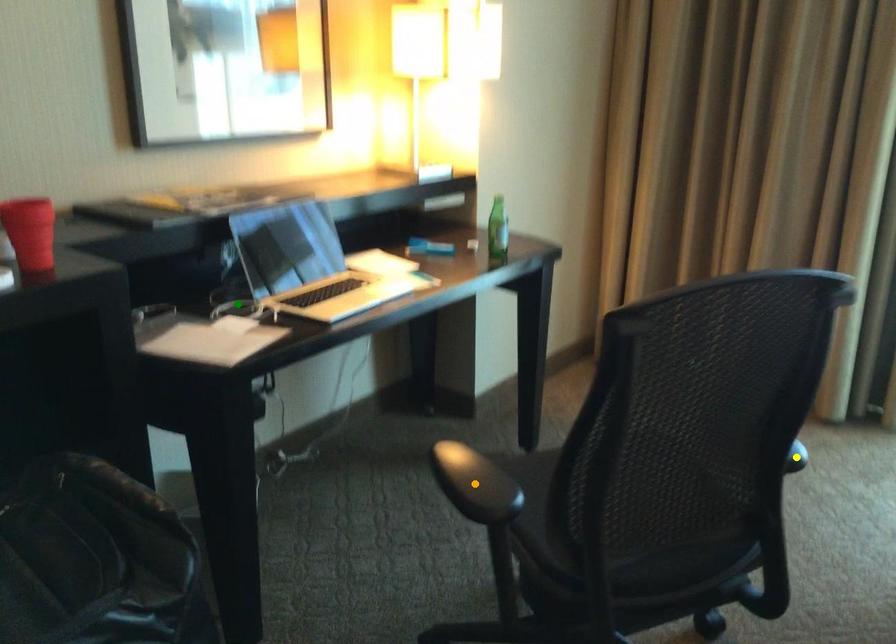
Order these from nearest to farthest:
1. green point
2. yellow point
3. orange point

orange point → green point → yellow point